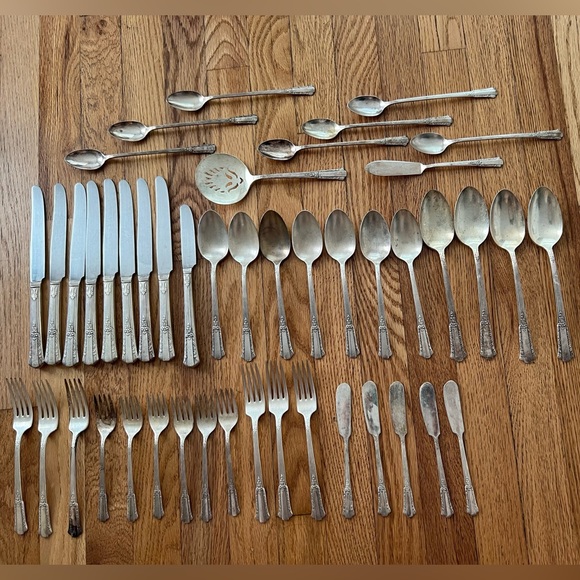
I want to click on butter spreaders, so click(346, 412), click(369, 414), click(395, 411), click(429, 416), click(455, 415).